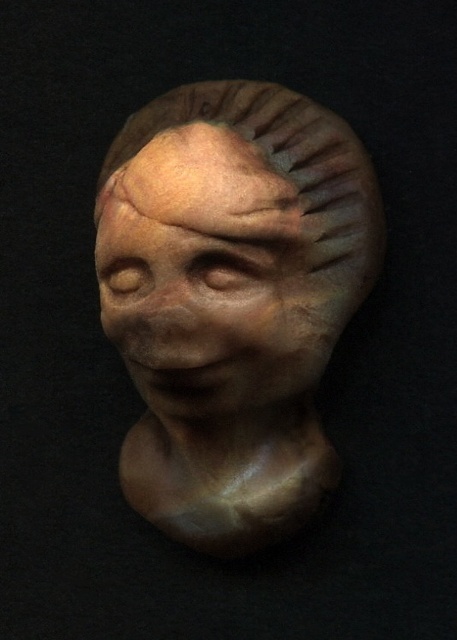
Question: Which of the following is the farthest from the observer?

Choices:
 (A) (279, 144)
 (B) (244, 180)

Answer: (A)

Question: Is matte clay head at center to the left of matte clay face at center from the viewer's perspective?

Choices:
 (A) yes
 (B) no

Answer: (B)

Question: Observing the image, what is the correct spatial positioning of matte clay head at center in reference to matte clay face at center?

Choices:
 (A) left
 (B) right

Answer: (B)

Question: Does matte clay head at center have a lesser width compared to matte clay face at center?

Choices:
 (A) yes
 (B) no

Answer: (B)

Question: Which point is farther from the camera taking this photo?

Choices:
 (A) pos(233,184)
 (B) pos(271,205)

Answer: (B)

Question: Which point is farther to the camera?

Choices:
 (A) (127, 198)
 (B) (138, 156)

Answer: (B)